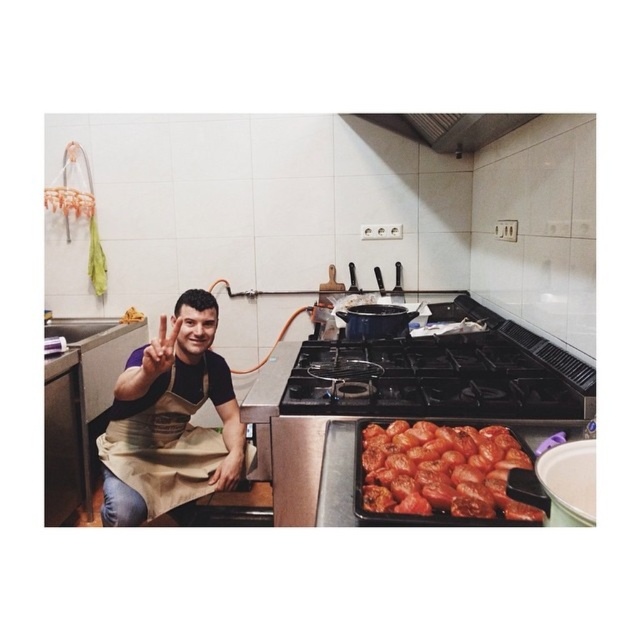
Question: Which object is farther from the camera taking this photo?

Choices:
 (A) beige apron at center
 (B) metallic at upper center
 (C) shiny red tomatoes at center

Answer: (B)

Question: Does shiny red tomatoes at center appear under metallic at upper center?

Choices:
 (A) yes
 (B) no

Answer: (A)

Question: Considering the real-world distances, which object is farthest from the shiny red tomatoes at center?

Choices:
 (A) beige apron at center
 (B) metallic at upper center

Answer: (B)

Question: Does shiny red tomatoes at center have a larger size compared to metallic at upper center?

Choices:
 (A) no
 (B) yes

Answer: (A)

Question: Is beige apron at center to the right of shiny red tomatoes at center from the viewer's perspective?

Choices:
 (A) no
 (B) yes

Answer: (A)

Question: Considering the real-world distances, which object is farthest from the beige apron at center?

Choices:
 (A) metallic at upper center
 (B) shiny red tomatoes at center

Answer: (A)